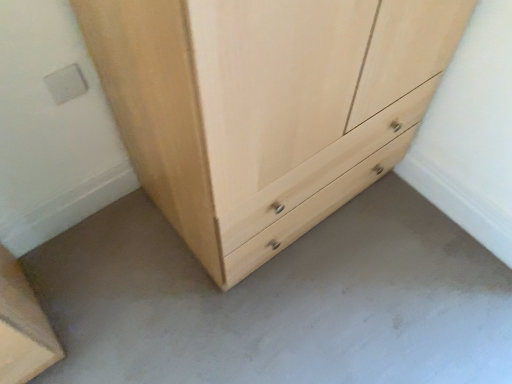
Locate an element on the screen. white plastic electric outlet at upper left is located at coordinates (66, 83).

The image size is (512, 384). What do you see at coordinates (66, 83) in the screenshot? I see `white plastic electric outlet at upper left` at bounding box center [66, 83].

What are the coordinates of `white plastic electric outlet at upper left` in the screenshot? It's located at (66, 83).